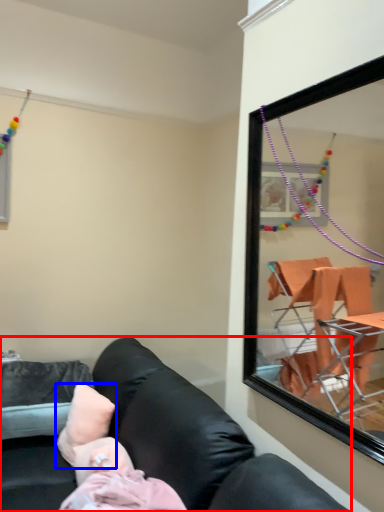
Question: Which point is further to the camera, studio couch (highlighted by a red box) or pillow (highlighted by a blue box)?

Choices:
 (A) studio couch
 (B) pillow

Answer: (B)